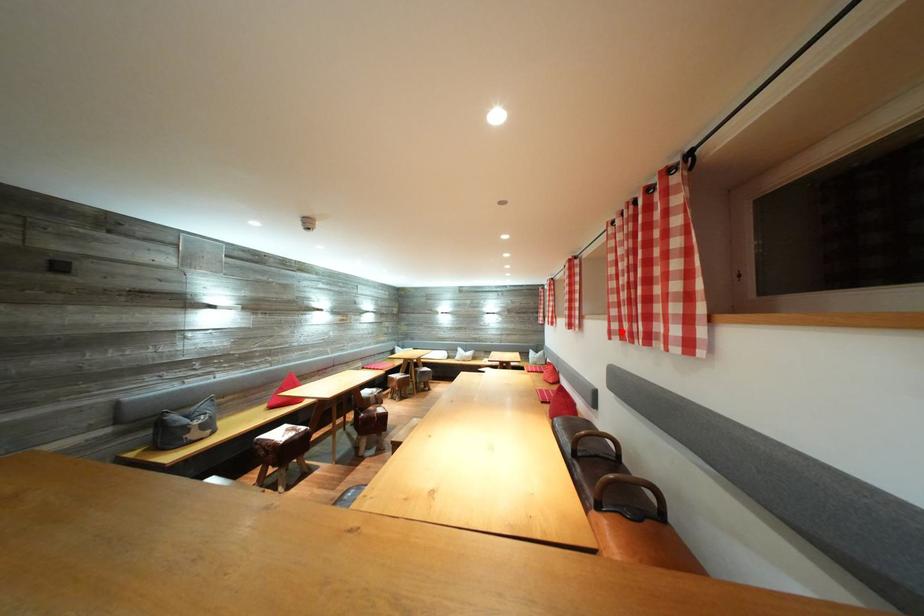
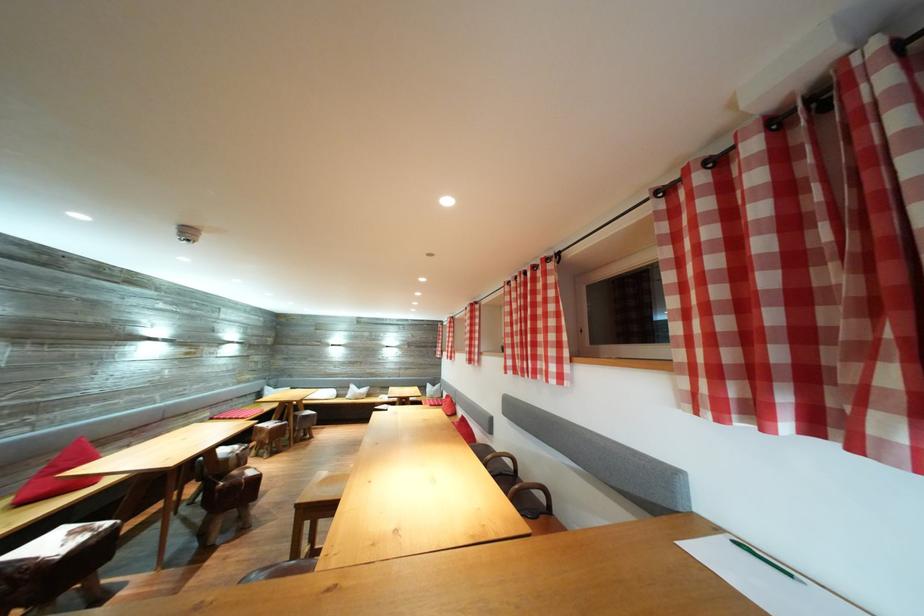
Find the pixel in the second image that matches the highlighted location in the first image.

(517, 368)